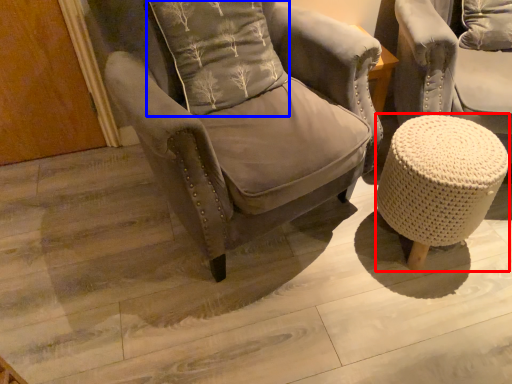
Question: Which point is further to the camera, bar stool (highlighted by a red box) or pillow (highlighted by a blue box)?

Choices:
 (A) bar stool
 (B) pillow

Answer: (A)